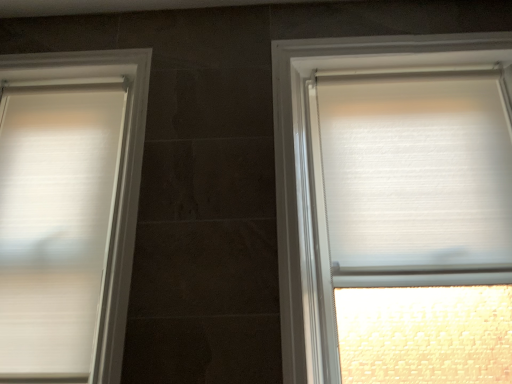
Question: Is white matte blinds at left, arranged as the 2th window when viewed from the right, at the right side of white textured blind at right?

Choices:
 (A) no
 (B) yes

Answer: (A)

Question: Does white matte blinds at left, arranged as the 2th window when viewed from the right, have a greater width compared to white textured blind at right?

Choices:
 (A) no
 (B) yes

Answer: (A)

Question: Is white matte blinds at left, arranged as the 2th window when viewed from the right, smaller than white textured blind at right?

Choices:
 (A) no
 (B) yes

Answer: (A)

Question: Are white matte blinds at left, arranged as the 2th window when viewed from the right, and white textured blind at right located far from each other?

Choices:
 (A) no
 (B) yes

Answer: (A)

Question: From the image's perspective, would you say white matte blinds at left, arranged as the 2th window when viewed from the right, is shown under white textured blind at right?

Choices:
 (A) no
 (B) yes

Answer: (B)

Question: Is white matte blinds at left, arranged as the 2th window when viewed from the right, facing away from white textured blind at right?

Choices:
 (A) no
 (B) yes

Answer: (A)

Question: Does white textured blind at right have a greater height compared to white matte blinds at left, acting as the 1th window starting from the left?

Choices:
 (A) yes
 (B) no

Answer: (B)

Question: From a real-world perspective, is white textured blind at right positioned over white matte blinds at left, arranged as the 2th window when viewed from the right, based on gravity?

Choices:
 (A) no
 (B) yes

Answer: (B)

Question: Does white textured blind at right touch white matte blinds at left, arranged as the 2th window when viewed from the right?

Choices:
 (A) yes
 (B) no

Answer: (B)

Question: Considering the relative sizes of white textured blind at right and white matte blinds at left, acting as the 1th window starting from the left, in the image provided, is white textured blind at right smaller than white matte blinds at left, acting as the 1th window starting from the left,?

Choices:
 (A) yes
 (B) no

Answer: (A)

Question: Is white textured blind at right outside white matte blinds at left, acting as the 1th window starting from the left?

Choices:
 (A) no
 (B) yes

Answer: (B)

Question: Is white matte blinds at left, arranged as the 2th window when viewed from the right, completely or partially inside white textured blind at right?

Choices:
 (A) no
 (B) yes

Answer: (A)

Question: From a real-world perspective, is white textured blind at right located beneath white textured roller blind at right, which is counted as the 2th window, starting from the left?

Choices:
 (A) no
 (B) yes

Answer: (A)